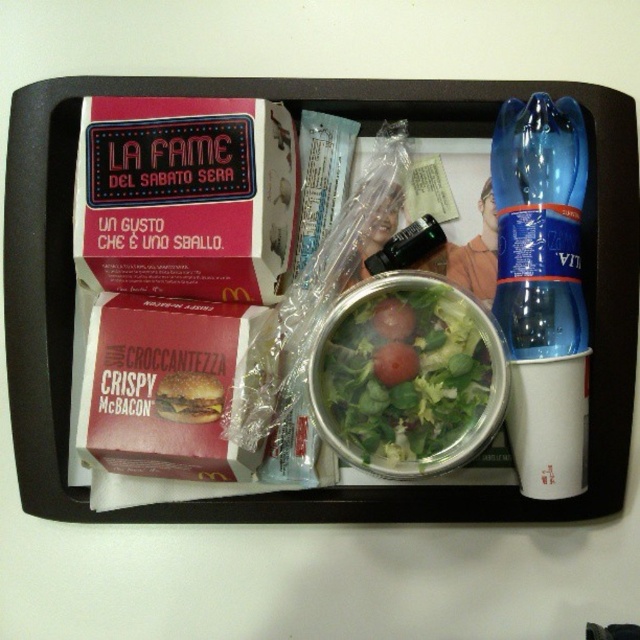
Question: Among these objects, which one is farthest from the camera?

Choices:
 (A) matte pink cardboard box at upper left
 (B) clear plastic salad bowl at center
 (C) blue plastic bottle at right

Answer: (C)

Question: In this image, where is clear plastic salad bowl at center located relative to green leafy salad at center?

Choices:
 (A) below
 (B) above

Answer: (B)

Question: Which point is farther from the camera taking this photo?

Choices:
 (A) (369, 93)
 (B) (500, 356)

Answer: (A)

Question: Is clear plastic salad bowl at center thinner than green leafy salad at center?

Choices:
 (A) no
 (B) yes

Answer: (A)

Question: Which point is closer to the camera?

Choices:
 (A) (508, 294)
 (B) (237, 90)

Answer: (A)

Question: Does matte pink cardboard box at upper left appear on the right side of crispy golden-brown mcbacon at center?

Choices:
 (A) yes
 (B) no

Answer: (B)